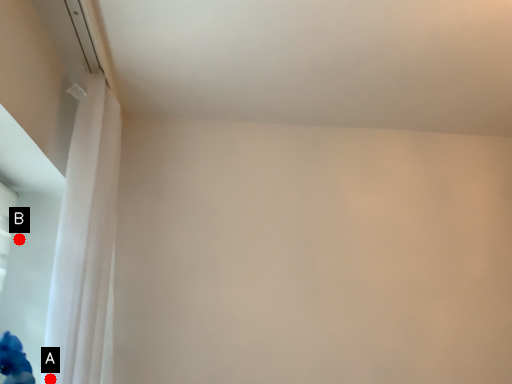
Question: Two points are circled on the image, labeled by A and B beside each circle. Among these points, which one is farthest from the camera?

Choices:
 (A) A is further
 (B) B is further

Answer: (B)